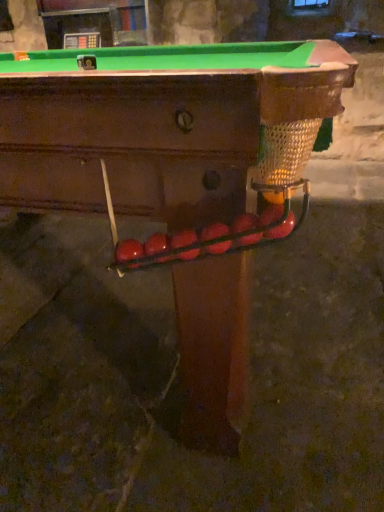
Question: In terms of width, does glossy red apple at right, which ranks as the first fruit in right-to-left order, look wider or thinner when compared to glossy red ball at center, which ranks as the fifth fruit in left-to-right order?

Choices:
 (A) thin
 (B) wide

Answer: (A)

Question: Visually, is glossy red apple at right, placed as the sixth fruit when sorted from left to right, positioned to the left or to the right of glossy red ball at center, the 2th fruit from the right?

Choices:
 (A) right
 (B) left

Answer: (A)

Question: Estimate the real-world distances between objects in this image. Which object is farther from the glossy red balls at center, the fifth fruit in the right-to-left sequence?

Choices:
 (A) glossy red apple at lower center, the 6th fruit viewed from the right
 (B) glossy red ball at center, placed as the 3th fruit when sorted from right to left
 (C) glossy red apple at right, which ranks as the first fruit in right-to-left order
 (D) rubberized red ball at center, which appears as the 3th fruit when viewed from the left
 (E) glossy red ball at center, which ranks as the fifth fruit in left-to-right order

Answer: (C)

Question: Considering the real-world distances, which object is closest to the glossy red balls at center, placed as the 2th fruit when sorted from left to right?

Choices:
 (A) glossy red apple at right, which ranks as the first fruit in right-to-left order
 (B) glossy red ball at center, the 4th fruit viewed from the left
 (C) glossy red ball at center, the 2th fruit from the right
 (D) rubberized red ball at center, placed as the fourth fruit when sorted from right to left
 (E) glossy red apple at lower center, the 6th fruit viewed from the right

Answer: (E)